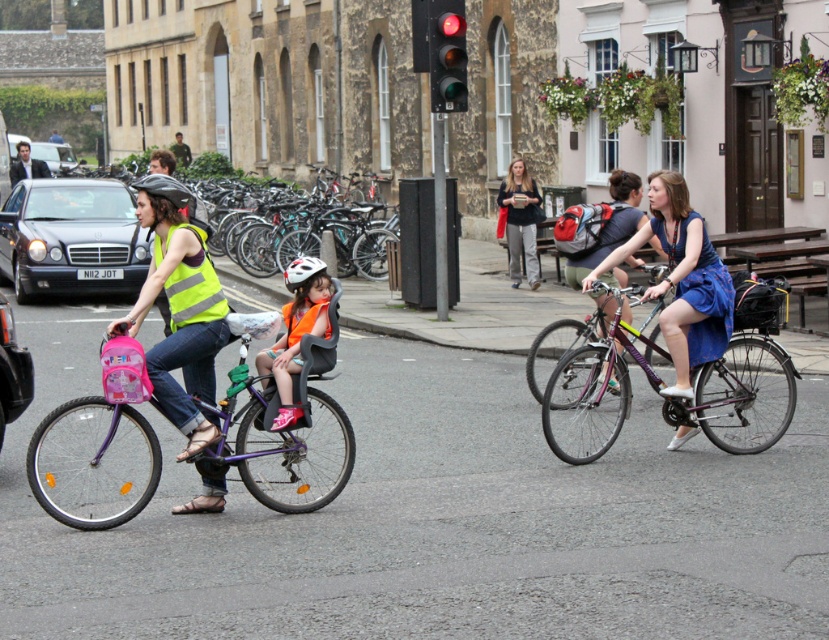
Is point (435, 12) closer to camera compared to point (183, 198)?

No, (435, 12) is behind (183, 198).

Does red glass traffic light at upper center lie in front of shiny black helmet at left?

No.

What do you see at coordinates (447, 54) in the screenshot? The width and height of the screenshot is (829, 640). I see `red glass traffic light at upper center` at bounding box center [447, 54].

The image size is (829, 640). Find the location of `red glass traffic light at upper center`. red glass traffic light at upper center is located at coordinates (447, 54).

Can you confirm if reflective yellow vest at left is smaller than red glass traffic light at upper center?

No.

Is reflective yellow vest at left thinner than red glass traffic light at upper center?

Incorrect, reflective yellow vest at left's width is not less than red glass traffic light at upper center's.

Which is behind, point (201, 424) or point (464, 65)?

Positioned behind is point (464, 65).

Where is `reflective yellow vest at left`? reflective yellow vest at left is located at coordinates pos(180,310).

Between purple matte bicycle at left and blue satin dress at center, which one appears on the right side from the viewer's perspective?

Positioned to the right is blue satin dress at center.

Does point (243, 458) come in front of point (686, 390)?

Yes, it is.

Who is more forward, (102,483) or (691,301)?

Positioned in front is point (102,483).

Identify the location of purple matte bicycle at left. This screenshot has width=829, height=640. (93, 461).